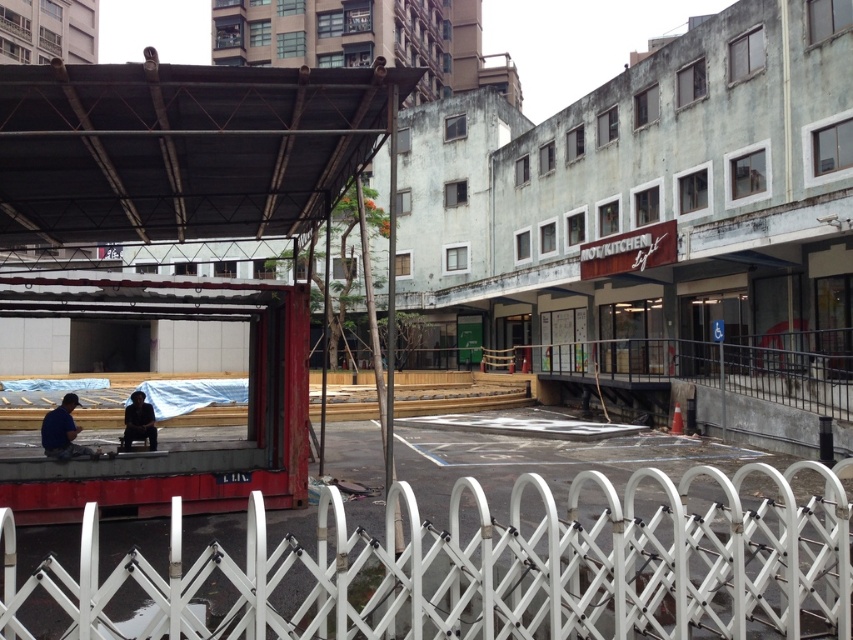
Does rusty metal shelter at left appear over black metal canopy at upper left?

Actually, rusty metal shelter at left is below black metal canopy at upper left.

From the picture: Does rusty metal shelter at left appear under black metal canopy at upper left?

Indeed, rusty metal shelter at left is positioned under black metal canopy at upper left.

This screenshot has height=640, width=853. I want to click on rusty metal shelter at left, so click(183, 147).

Find the location of a particular element. The width and height of the screenshot is (853, 640). rusty metal shelter at left is located at coordinates (183, 147).

Can you confirm if white plastic fence at lower center is taller than rusty metal shelter at left?

Yes.

Can you confirm if white plastic fence at lower center is wider than rusty metal shelter at left?

Yes.

Is point (624, 596) closer to viewer compared to point (297, 204)?

Yes.

This screenshot has height=640, width=853. Find the location of `white plastic fence at lower center`. white plastic fence at lower center is located at coordinates (488, 570).

Can you confirm if black metal canopy at upper left is bigger than blue fabric man at lower left?

Yes, black metal canopy at upper left is bigger than blue fabric man at lower left.

Who is more forward, (207,179) or (76,426)?

Point (207,179) is in front.

At what (x,y) coordinates should I click in order to perform the action: click on black metal canopy at upper left. Please return your answer as a coordinate pair (x, y). Looking at the image, I should click on (183, 147).